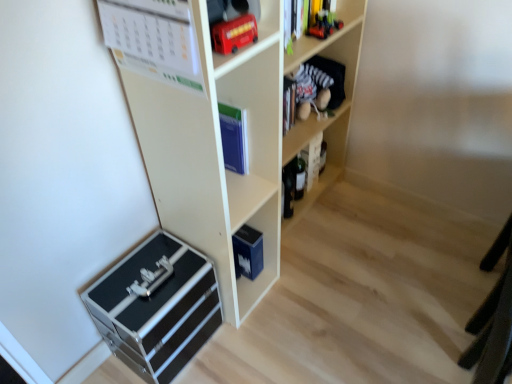
Find the location of a particular element. This screenshot has height=384, width=512. vacant area located to the right-hand side of black metallic toolbox at lower left, which appears as the 4th shelf when viewed from the top is located at coordinates (247, 350).